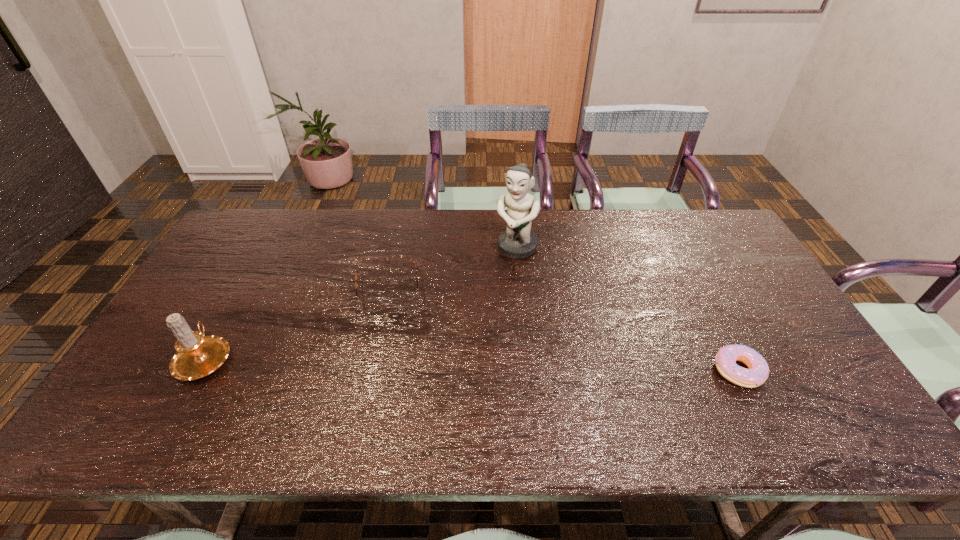
I want to click on the leftmost object, so click(197, 356).

In order to click on the second tallest object in this screenshot , I will do `click(197, 356)`.

Locate an element on the screen. This screenshot has height=540, width=960. doughnut is located at coordinates (725, 360).

Find the location of `the rightmost object`. the rightmost object is located at coordinates (725, 360).

I want to click on the third object from left to right, so click(x=518, y=241).

Identify the location of figurine. The width and height of the screenshot is (960, 540). (518, 241).

Identify the location of the second farthest object. The height and width of the screenshot is (540, 960). (406, 301).

Locate an element on the screen. The image size is (960, 540). the second shortest object is located at coordinates click(x=406, y=301).

Locate an element on the screen. Image resolution: width=960 pixels, height=540 pixels. free point located 0.190m on the back of the candle is located at coordinates (247, 284).

Where is `vacant space located on the back of the doughnut`? The width and height of the screenshot is (960, 540). vacant space located on the back of the doughnut is located at coordinates (708, 312).